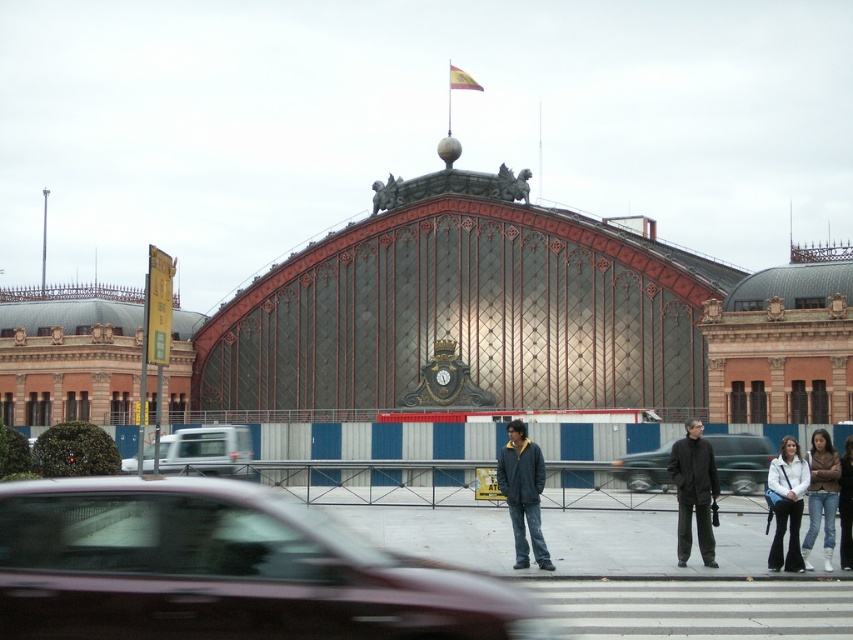
Which is above, metallic maroon sedan at center or dark blue denim jeans at center?

dark blue denim jeans at center is higher up.

Who is more distant from viewer, (134, 547) or (503, 460)?

Positioned behind is point (503, 460).

The height and width of the screenshot is (640, 853). I want to click on metallic maroon sedan at center, so click(x=224, y=570).

Is dark blue denim jeans at center shorter than jeans at center?

No.

This screenshot has height=640, width=853. What do you see at coordinates (523, 493) in the screenshot?
I see `dark blue denim jeans at center` at bounding box center [523, 493].

Where is `dark blue denim jeans at center`? dark blue denim jeans at center is located at coordinates (523, 493).

Between white matte van at center and dark blue denim jeans at center, which one appears on the right side from the viewer's perspective?

dark blue denim jeans at center is more to the right.

Which is more to the left, white matte van at center or dark blue denim jeans at center?

Positioned to the left is white matte van at center.

This screenshot has height=640, width=853. Describe the element at coordinates (202, 452) in the screenshot. I see `white matte van at center` at that location.

This screenshot has width=853, height=640. I want to click on white matte van at center, so click(202, 452).